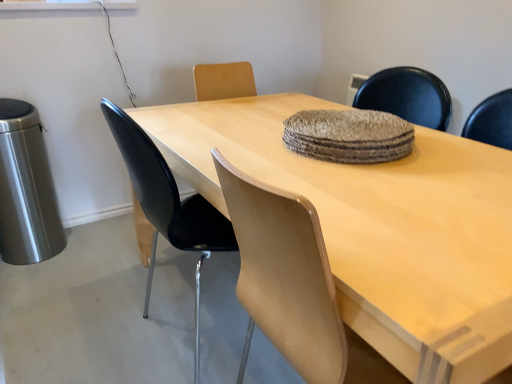
Identify the location of space that is in front of textured woven mat at center. The height and width of the screenshot is (384, 512). (388, 190).